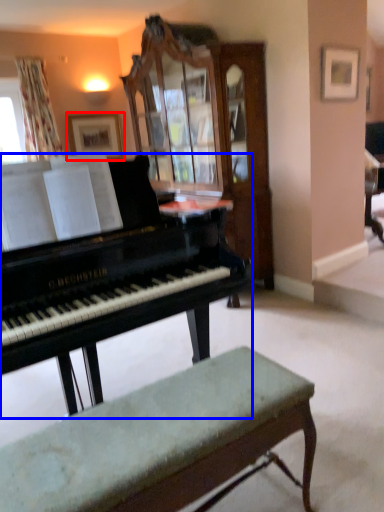
Question: Which of the following is the farthest to the observer, picture frame (highlighted by a red box) or piano (highlighted by a blue box)?

Choices:
 (A) picture frame
 (B) piano

Answer: (A)